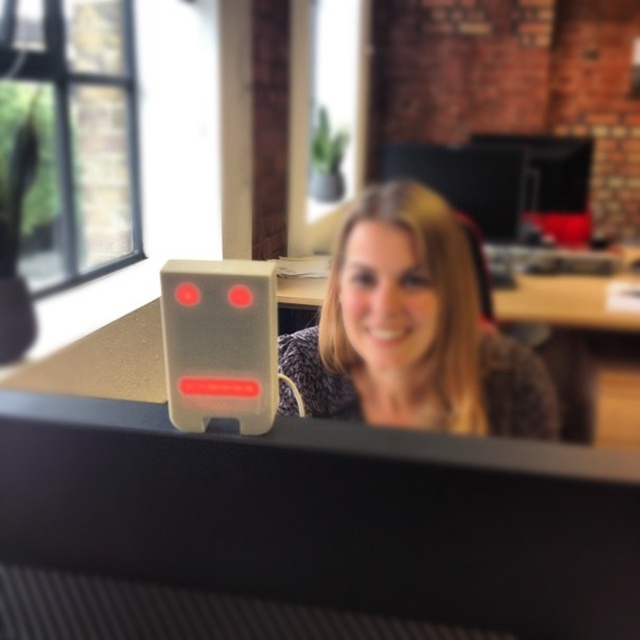
You are standing in the workspace shown in the image. There are two points marked as point 1 and point 2. Point 1 is at coordinates point [536,544] and point 2 is at coordinates point [362,284]. Which point is closer to you, the observer?

Point 1 is closer to you because it is in front of point 2.

You are trying to determine if the black plastic computer monitor at center can fit horizontally on a desk that is exactly the width of the speckled fabric shirt at center. Can it fit?

The black plastic computer monitor at center might be wider than speckled fabric shirt at center, so it may not fit on the desk if the desk is exactly the width of the speckled fabric shirt at center.

You are organizing items on a desk and need to place the black plastic computer monitor at center and the speckled fabric shirt at center. Given their sizes, which item should you place first to ensure both fit properly?

The black plastic computer monitor at center is smaller than the speckled fabric shirt at center. Therefore, you should place the larger item, the speckled fabric shirt at center, first to ensure proper placement and accommodate the smaller monitor afterward.